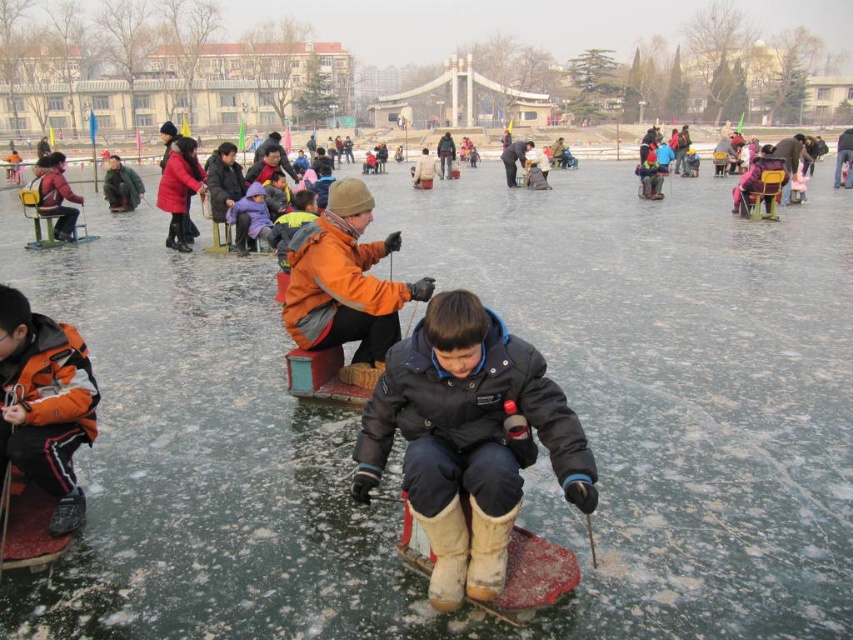
Question: Is dark blue matte jacket at center positioned at the back of matte red coat at upper left?

Choices:
 (A) no
 (B) yes

Answer: (A)

Question: Estimate the real-world distances between objects in this image. Which object is farther from the green fuzzy jacket at left?

Choices:
 (A) orange fleece jacket at lower left
 (B) dark blue matte jacket at center
 (C) matte red coat at upper left

Answer: (B)

Question: Among these objects, which one is farthest from the camera?

Choices:
 (A) matte red coat at upper left
 (B) green fuzzy jacket at left

Answer: (B)

Question: Which point is closer to the camera taking this photo?

Choices:
 (A) (135, 188)
 (B) (508, 144)
 (C) (323, 280)

Answer: (C)

Question: Considering the relative positions of dark blue matte jacket at center and matte red coat at upper left in the image provided, where is dark blue matte jacket at center located with respect to matte red coat at upper left?

Choices:
 (A) above
 (B) below

Answer: (B)

Question: In this image, where is orange fleece jacket at lower left located relative to matte red coat at upper left?

Choices:
 (A) left
 (B) right

Answer: (B)